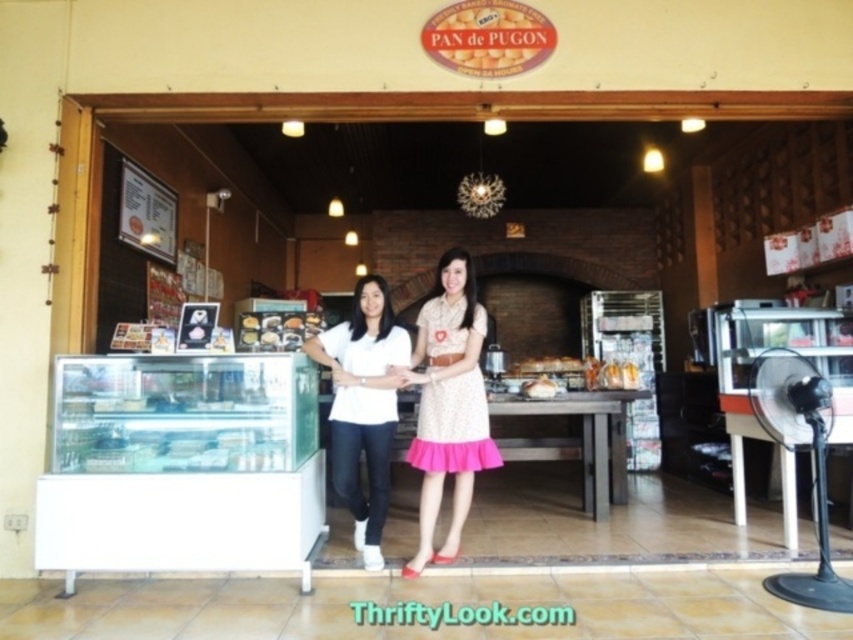
Question: Can you confirm if matte brown bread at center is thinner than golden brown bread at center?

Choices:
 (A) yes
 (B) no

Answer: (B)

Question: Which of these objects is positioned farthest from the golden brown bread at center?

Choices:
 (A) white matte shirt at center
 (B) pink satin dress at center
 (C) matte brown bread at center

Answer: (C)

Question: Is pink satin dress at center bigger than golden brown bread at center?

Choices:
 (A) no
 (B) yes

Answer: (B)

Question: Which of these objects is positioned closest to the pink satin dress at center?

Choices:
 (A) matte brown bread at center
 (B) white matte shirt at center
 (C) golden brown bread at center

Answer: (B)

Question: Which object is farther from the camera taking this photo?

Choices:
 (A) matte brown bread at center
 (B) white matte shirt at center
 (C) pink satin dress at center
 (D) golden brown bread at center

Answer: (D)

Question: Can you confirm if matte brown bread at center is bigger than golden brown bread at center?

Choices:
 (A) yes
 (B) no

Answer: (A)